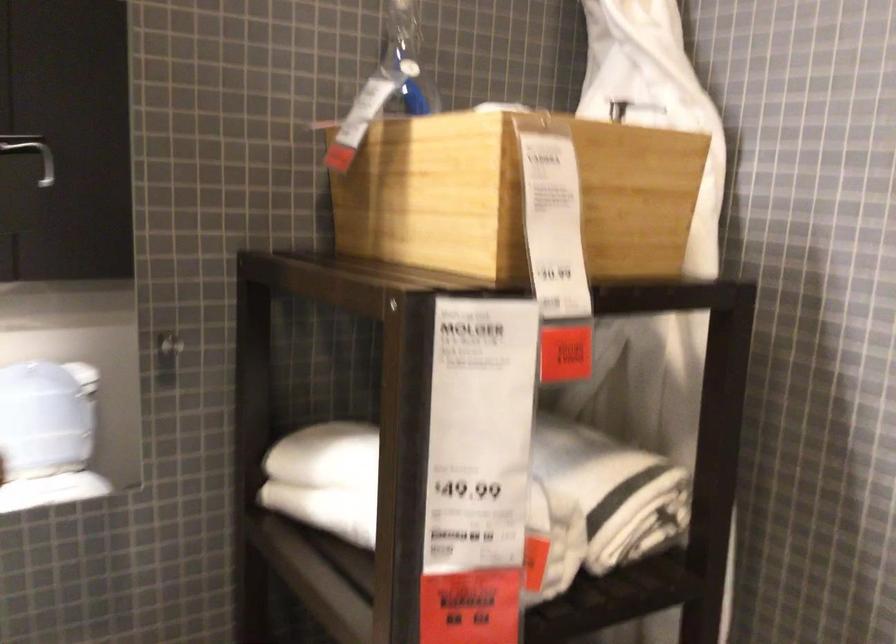
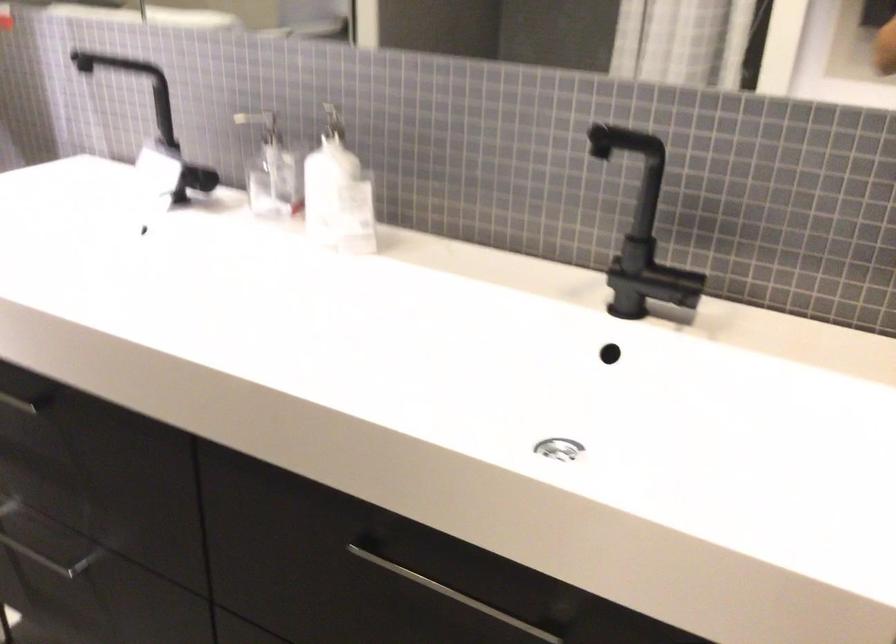
First-person continuous shooting, in which direction is the camera rotating?

The camera's rotation is toward left-down.